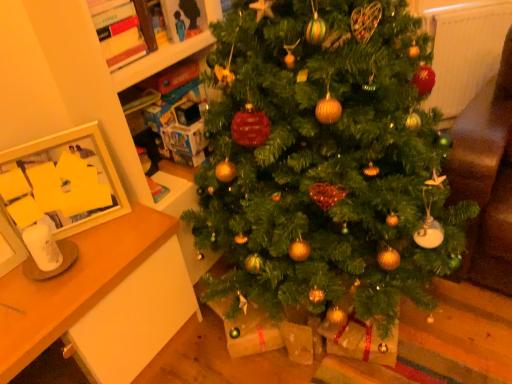
Where is `vacant area on top of wooden desk at left (from a real-world perspective)`? vacant area on top of wooden desk at left (from a real-world perspective) is located at coordinates (69, 258).